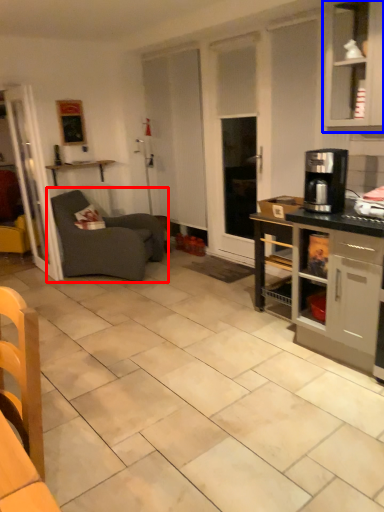
Question: Which object appears closest to the camera in this image, studio couch (highlighted by a red box) or cabinetry (highlighted by a blue box)?

Choices:
 (A) studio couch
 (B) cabinetry

Answer: (B)